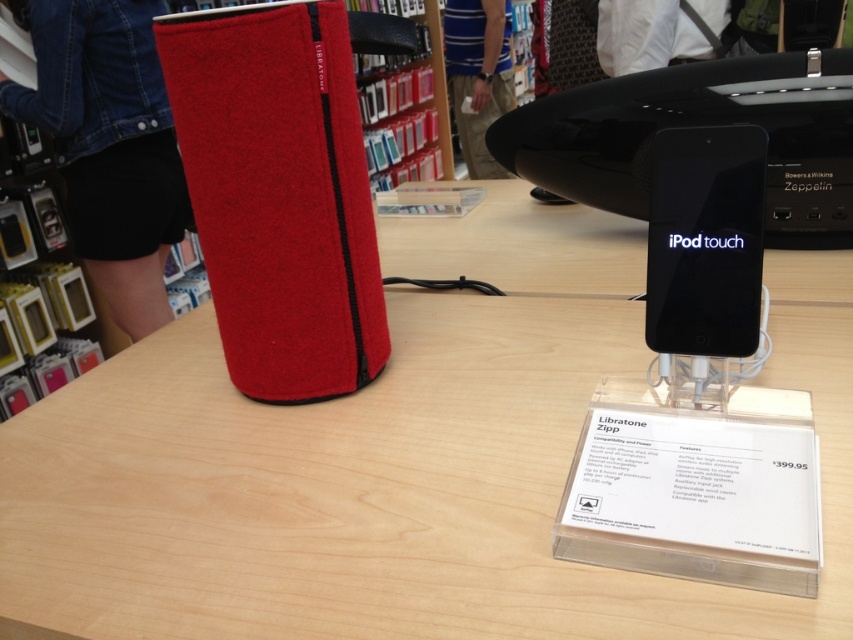
Question: Which point is farther to the camera?

Choices:
 (A) (689, 294)
 (B) (548, 636)

Answer: (A)

Question: Is wooden table at center further to camera compared to black glossy ipod touch at center?

Choices:
 (A) no
 (B) yes

Answer: (A)

Question: Can you confirm if wooden table at center is bigger than black glossy ipod touch at center?

Choices:
 (A) no
 (B) yes

Answer: (B)

Question: Is wooden table at center smaller than black glossy ipod touch at center?

Choices:
 (A) no
 (B) yes

Answer: (A)

Question: Which object is farther from the camera taking this photo?

Choices:
 (A) wooden table at center
 (B) black glossy ipod touch at center

Answer: (B)